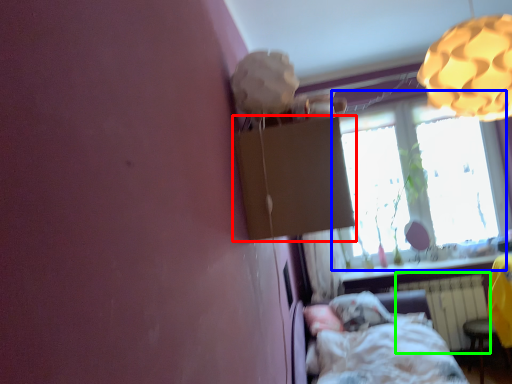
Question: Which is farther away from cardboard box (highlighted by a red box)? window (highlighted by a blue box) or radiator (highlighted by a green box)?

Choices:
 (A) window
 (B) radiator

Answer: (A)